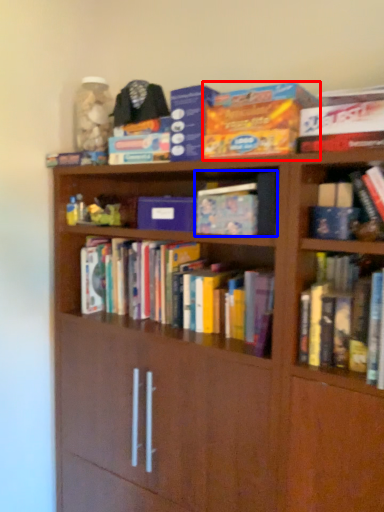
Question: Which point is closer to the camera, paperback book (highlighted by a red box) or book (highlighted by a blue box)?

Choices:
 (A) paperback book
 (B) book

Answer: (A)